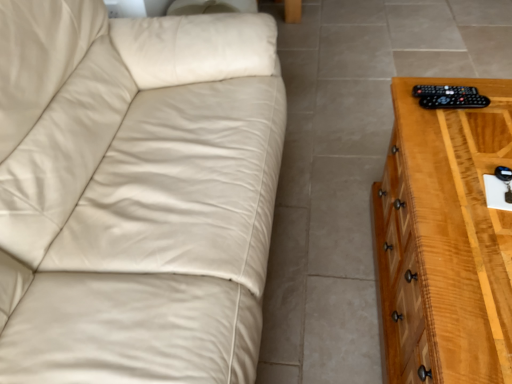
Where is `free space on the front side of black plastic remote at right`? Image resolution: width=512 pixels, height=384 pixels. free space on the front side of black plastic remote at right is located at coordinates (460, 148).